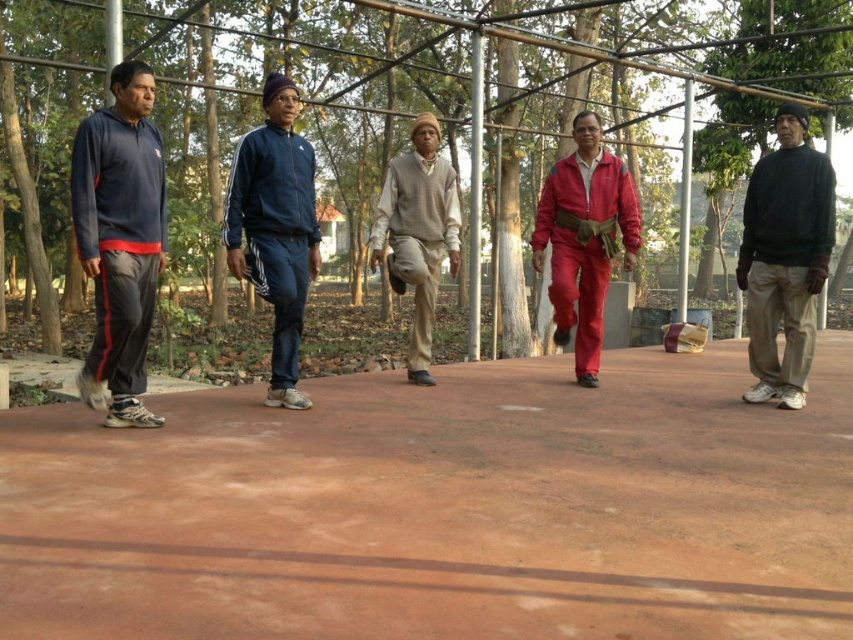
You are standing at the point labeled point (372, 632) and want to walk to the point labeled point (558, 307). Which direction should you face to move towards it?

Since point (372, 632) is closer to the camera than point (558, 307), you should face away from the camera to move towards point (558, 307).

You are standing on the reddish brown paved surface where the five individuals are gathered. You need to walk to the brown concrete path at center. In which direction should you walk to reach it?

The brown concrete path at center is located at point [442,508], so you should walk towards the center of the image to reach it.